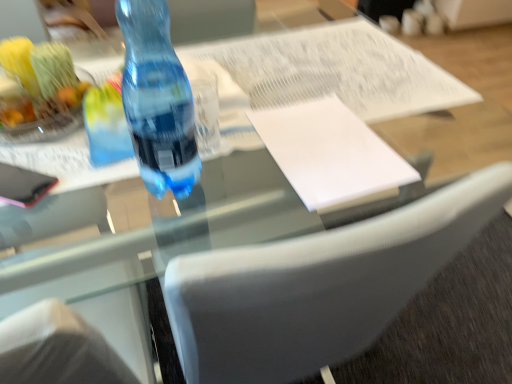
Question: Does shiny plastic fruit bowl at upper left have a larger size compared to white paper at center?

Choices:
 (A) yes
 (B) no

Answer: (A)

Question: Is shiny plastic fruit bowl at upper left far away from white paper at center?

Choices:
 (A) no
 (B) yes

Answer: (A)

Question: Is shiny plastic fruit bowl at upper left positioned behind white paper at center?

Choices:
 (A) no
 (B) yes

Answer: (A)

Question: Is shiny plastic fruit bowl at upper left not within white paper at center?

Choices:
 (A) yes
 (B) no

Answer: (A)

Question: Does shiny plastic fruit bowl at upper left appear on the left side of white paper at center?

Choices:
 (A) yes
 (B) no

Answer: (A)

Question: Does point (270, 114) appear closer or farther from the camera than point (53, 104)?

Choices:
 (A) farther
 (B) closer

Answer: (A)

Question: Is white paper at center wider or thinner than shiny plastic fruit bowl at upper left?

Choices:
 (A) wide
 (B) thin

Answer: (A)

Question: From a real-world perspective, is white paper at center positioned above or below shiny plastic fruit bowl at upper left?

Choices:
 (A) above
 (B) below

Answer: (B)

Question: From the image's perspective, relative to shiny plastic fruit bowl at upper left, is white paper at center above or below?

Choices:
 (A) below
 (B) above

Answer: (A)

Question: From a real-world perspective, is blue translucent bottle at center positioned above or below shiny plastic fruit bowl at upper left?

Choices:
 (A) above
 (B) below

Answer: (A)

Question: Looking at their shapes, would you say blue translucent bottle at center is wider or thinner than shiny plastic fruit bowl at upper left?

Choices:
 (A) thin
 (B) wide

Answer: (A)

Question: Does point (181, 104) appear closer or farther from the camera than point (7, 67)?

Choices:
 (A) closer
 (B) farther

Answer: (A)

Question: From their relative heights in the image, would you say blue translucent bottle at center is taller or shorter than shiny plastic fruit bowl at upper left?

Choices:
 (A) tall
 (B) short

Answer: (A)

Question: Is white paper at center wider or thinner than blue translucent bottle at center?

Choices:
 (A) thin
 (B) wide

Answer: (B)

Question: Considering their positions, is white paper at center located in front of or behind blue translucent bottle at center?

Choices:
 (A) behind
 (B) front

Answer: (A)